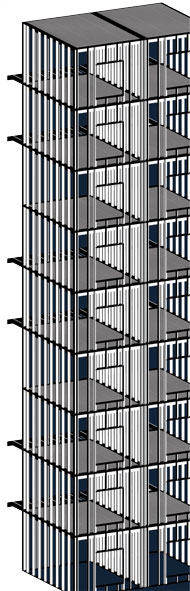
Locate an element on the screen. Image resolution: width=190 pixels, height=591 pixels. seventh floor rooms is located at coordinates 105,210, 171,197.